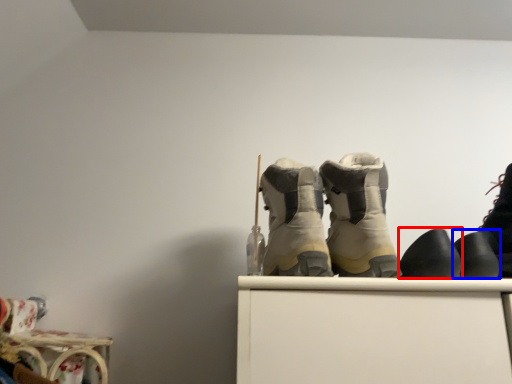
Question: Which object is further to the camera taking this photo, footwear (highlighted by a red box) or footwear (highlighted by a blue box)?

Choices:
 (A) footwear
 (B) footwear

Answer: (B)